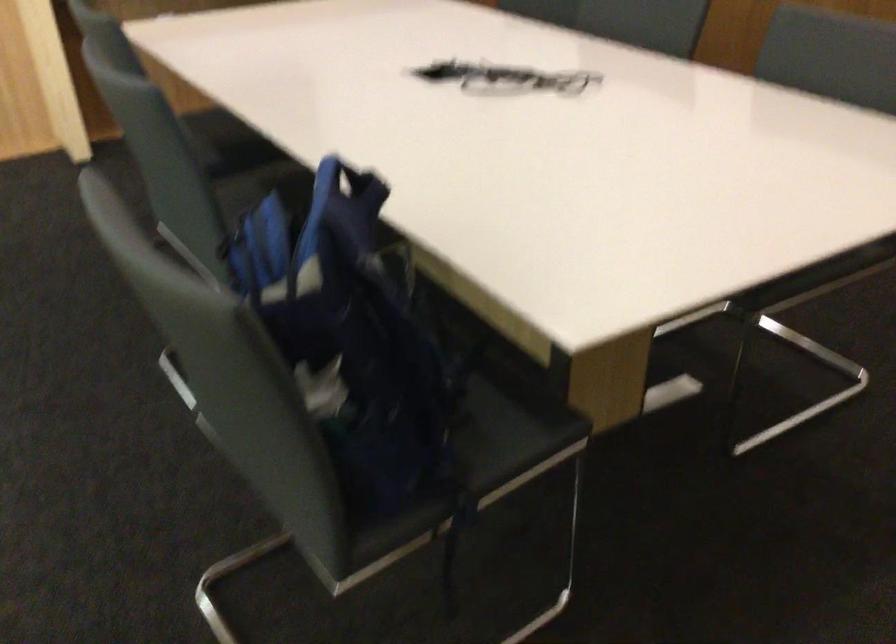
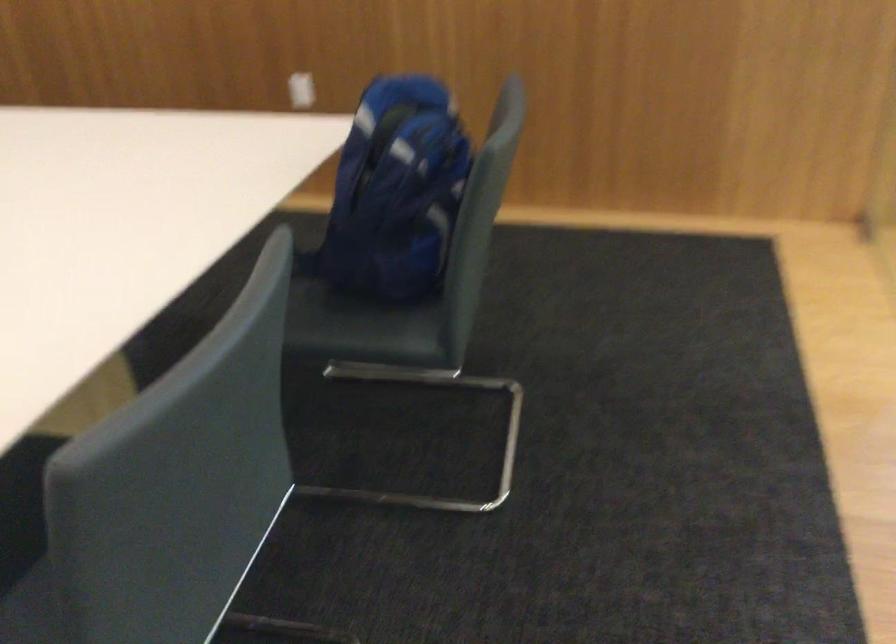
The point at [289,281] is marked in the first image. Where is the corresponding point in the second image?

(395, 192)